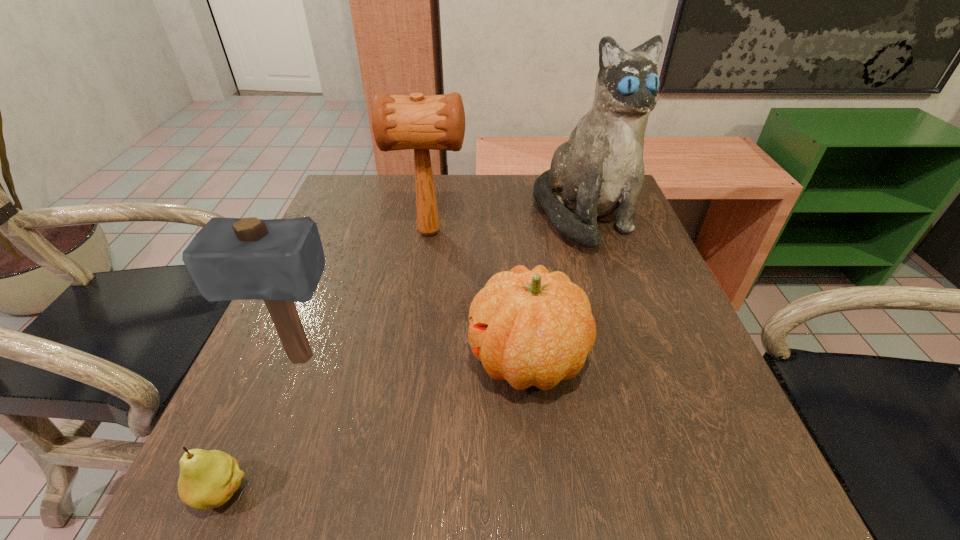
You are a GUI agent. You are given a task and a screenshot of the screen. Output one action in this format:
    pyautogui.click(x=<x>, y=<y>)
    Task: Click on the free spot between the right mallet and the shortest object
    This screenshot has width=960, height=540.
    Given the screenshot: What is the action you would take?
    pyautogui.click(x=325, y=362)

Identify the location of vacant area that lies between the left mallet and the third object from right to left. (365, 295).

Where is `vacant space that is in between the tallest object and the nearer mallet`? vacant space that is in between the tallest object and the nearer mallet is located at coordinates (442, 287).

Where is `free spot between the farther mallet and the left mallet`? The width and height of the screenshot is (960, 540). free spot between the farther mallet and the left mallet is located at coordinates (365, 295).

The image size is (960, 540). In order to click on the third closest object to the cat in this screenshot , I will do `click(280, 261)`.

Locate which object is the second closest to the farther mallet. Please provide its 2D coordinates. Your answer should be formatted as a tuple, i.e. [(x, y)], where the tuple contains the x and y coordinates of a point satisfying the conditions above.

[(531, 328)]

Find the location of `vacant point that satisfies the following two spatial constraints: 1. on the strike surface of the third object from right to left; 2. on the front side of the nearest object`. vacant point that satisfies the following two spatial constraints: 1. on the strike surface of the third object from right to left; 2. on the front side of the nearest object is located at coordinates (391, 491).

Locate an element on the screen. The image size is (960, 540). vacant space that satisfies the following two spatial constraints: 1. at the face of the tallest object; 2. on the carved face of the pumpkin is located at coordinates (629, 359).

Find the location of `blank area in the image that satisfies the following two spatial constraints: 1. at the face of the tallest object; 2. on the strike surface of the right mallet`. blank area in the image that satisfies the following two spatial constraints: 1. at the face of the tallest object; 2. on the strike surface of the right mallet is located at coordinates (588, 232).

Locate an element on the screen. The image size is (960, 540). vacant region that satisfies the following two spatial constraints: 1. on the carved face of the fourth tallest object; 2. on the front side of the pear is located at coordinates (540, 491).